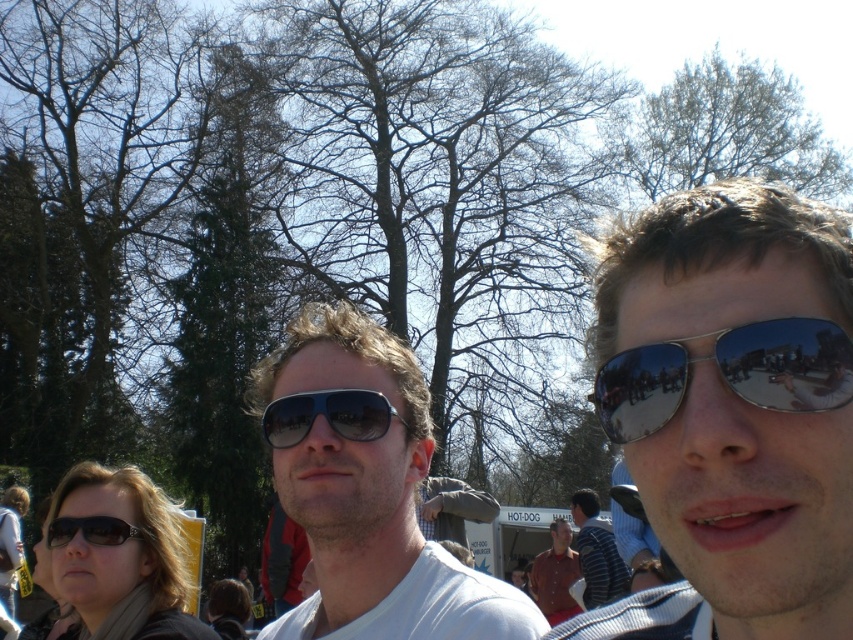
Who is more forward, (363, 570) or (51, 525)?

Point (363, 570)

Between matte white shirt at center and matte black sunglasses at lower left, which one appears on the right side from the viewer's perspective?

matte white shirt at center is more to the right.

Image resolution: width=853 pixels, height=640 pixels. I want to click on matte white shirt at center, so click(x=366, y=490).

Between sunglasses at center and matte black sunglasses at lower left, which one has less height?

matte black sunglasses at lower left is shorter.

Is sunglasses at center bigger than matte black sunglasses at lower left?

No.

Is point (595, 410) more distant than point (96, 529)?

That is False.

You are a GUI agent. You are given a task and a screenshot of the screen. Output one action in this format:
    pyautogui.click(x=<x>, y=<y>)
    Task: Click on the sunglasses at center
    The width and height of the screenshot is (853, 640).
    Given the screenshot: What is the action you would take?
    pyautogui.click(x=730, y=410)

Who is positioned more to the right, matte white shirt at center or silver reflective sunglasses at right?

silver reflective sunglasses at right is more to the right.

Looking at this image, does matte white shirt at center have a greater width compared to silver reflective sunglasses at right?

Yes, matte white shirt at center is wider than silver reflective sunglasses at right.

Is point (251, 413) positioned behind point (746, 333)?

Yes, point (251, 413) is farther from viewer.

Where is `matte white shirt at center`? The image size is (853, 640). matte white shirt at center is located at coordinates (366, 490).